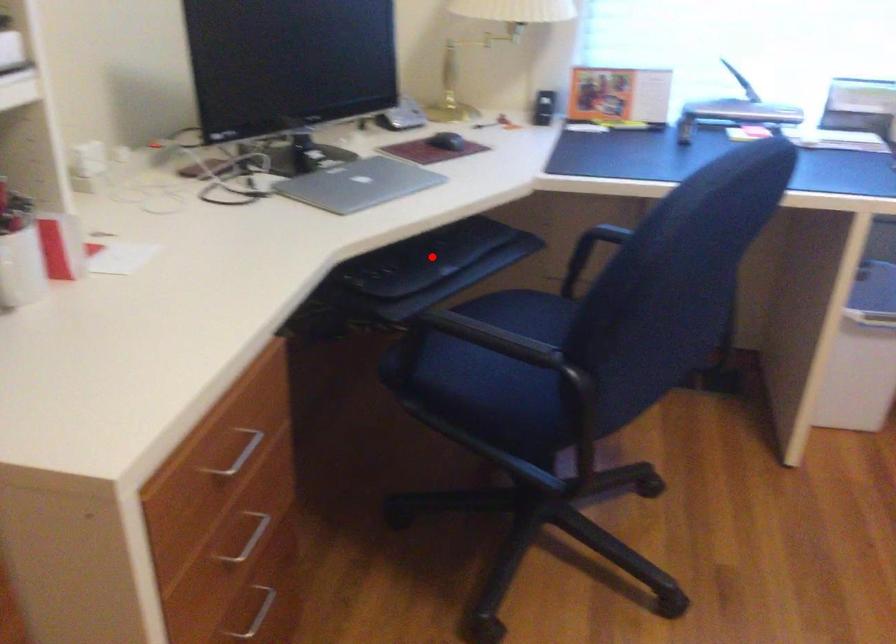
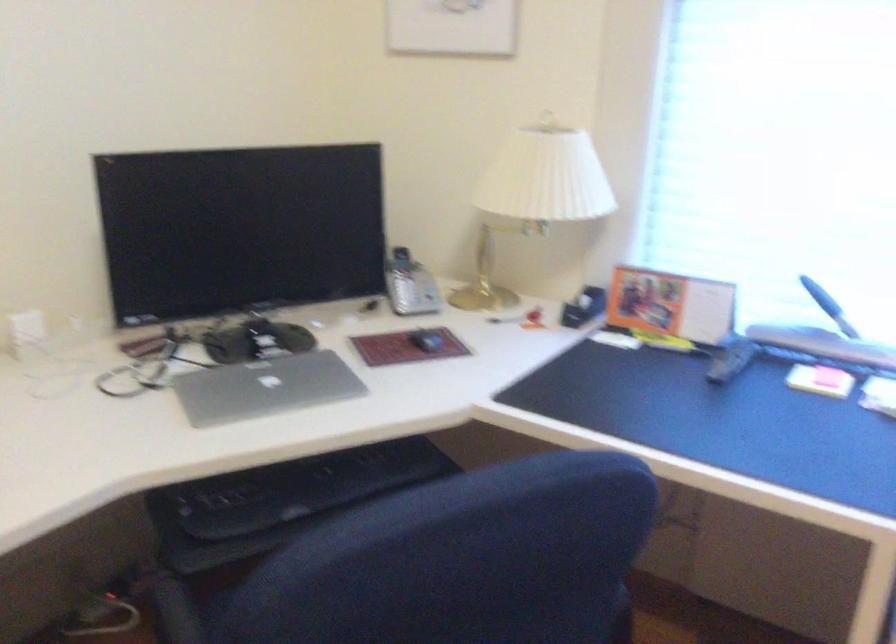
Question: I am providing you with two images of the same scene from different viewpoints. Image1 has a red point marked. In image2, the corresponding 3D location appears at what relative position? Reply with the corresponding letter.

Choices:
 (A) Closer
 (B) Farther

Answer: (A)